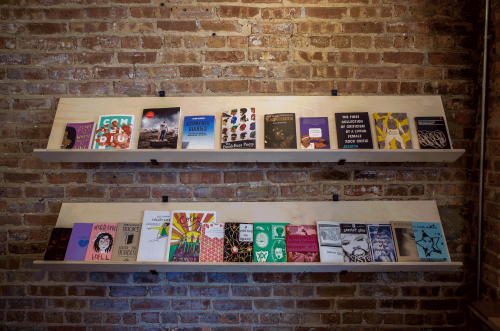
Locate an element on the screen. reading material on the top shelf only is located at coordinates (431, 131), (390, 132), (349, 134), (312, 136), (278, 136), (236, 134), (197, 139), (150, 139), (112, 138), (75, 140).